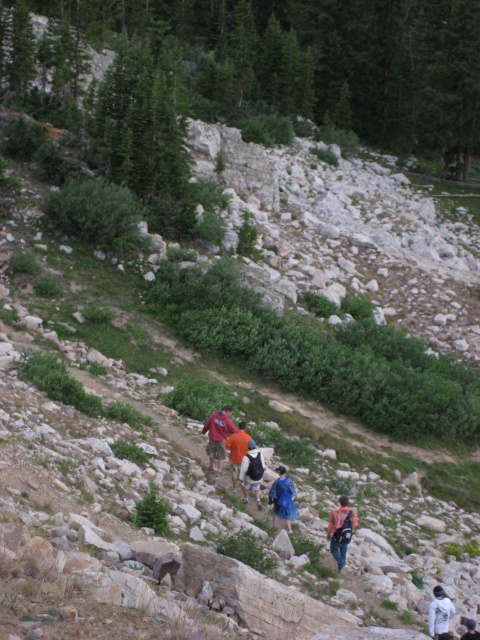
You are a photographer positioned at the lower center of the scene. You want to capture a photo that includes both the denim jacket at lower center and the white fabric jacket at lower right. Given their current positions, can you frame both jackets in a single shot without moving your camera? Explain your reasoning.

The denim jacket at lower center and white fabric jacket at lower right are 11.89 feet apart from each other. Depending on the camera lens used, a wide angle lens could potentially capture both jackets in a single frame without moving the camera, as the distance between them may fall within the field of view of such a lens.